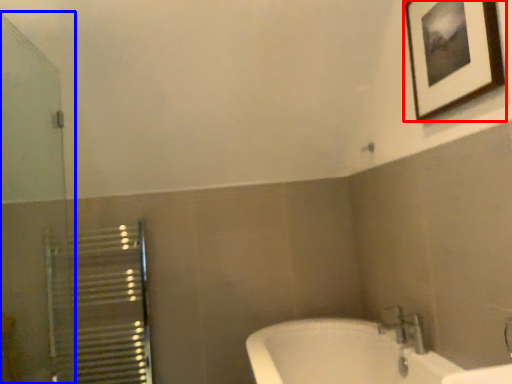
Question: Which object is closer to the camera taking this photo, picture frame (highlighted by a red box) or screen door (highlighted by a blue box)?

Choices:
 (A) picture frame
 (B) screen door

Answer: (B)